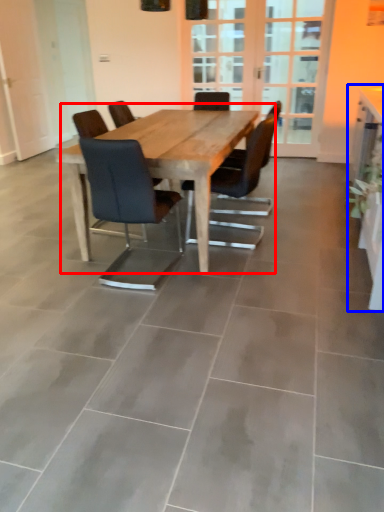
Question: Which of the following is the farthest to the observer, kitchen & dining room table (highlighted by a red box) or computer desk (highlighted by a blue box)?

Choices:
 (A) kitchen & dining room table
 (B) computer desk

Answer: (A)